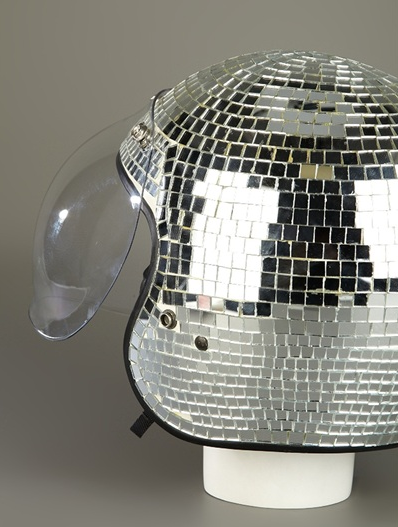
Locate an element on the screen. This screenshot has height=527, width=398. round thing to place the armor on for dispay is located at coordinates (287, 490).